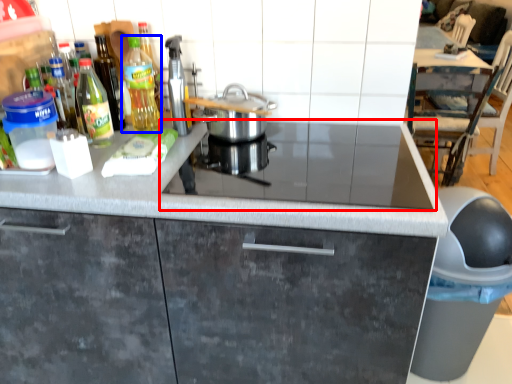
Question: Which of the following is the farthest to the observer, gas stove (highlighted by a red box) or kitchen appliance (highlighted by a blue box)?

Choices:
 (A) gas stove
 (B) kitchen appliance

Answer: (B)